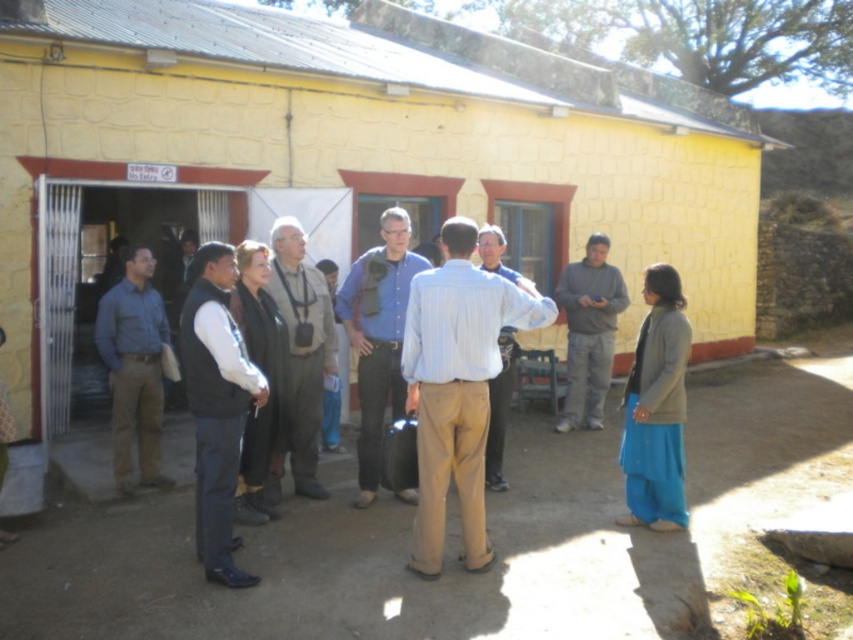
You are a photographer trying to capture a closeup of the gray fabric vest at center and the gray cotton sweater at center. Since you want both items to appear equally sized in the photo, which object should you move closer to the camera?

The gray fabric vest at center is smaller than the gray cotton sweater at center. To make them appear the same size in the photo, you should move the gray fabric vest at center closer to the camera.

You are standing in front of the yellow brick building and want to take a photo that includes both the point at coordinates point (316, 275) and the point at coordinates point (618, 272). Which point should you focus on first to ensure both are in clear view?

You should focus on point (316, 275) first because it is closer to the camera than point (618, 272), ensuring both points remain in focus.

You are standing at the entrance of the yellow brick building with a metal gate partially open. There are two points marked in the scene, point A at coordinates point (231, 481) and point B at coordinates point (505, 374). Which point is closer to you?

Point point (231, 481) is closer to the viewer than point point (505, 374).